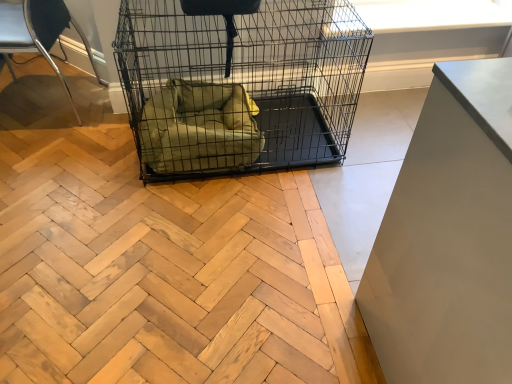
Question: Is metallic silver chair at left facing towards green fabric dog bed at center?

Choices:
 (A) no
 (B) yes

Answer: (A)

Question: Is metallic silver chair at left closer to the viewer compared to green fabric dog bed at center?

Choices:
 (A) yes
 (B) no

Answer: (A)

Question: Would you say metallic silver chair at left is outside green fabric dog bed at center?

Choices:
 (A) yes
 (B) no

Answer: (A)

Question: From a real-world perspective, does metallic silver chair at left sit lower than green fabric dog bed at center?

Choices:
 (A) no
 (B) yes

Answer: (A)

Question: Does metallic silver chair at left have a greater height compared to green fabric dog bed at center?

Choices:
 (A) no
 (B) yes

Answer: (B)

Question: Do you think white matte cabinet at right is within metallic silver chair at left, or outside of it?

Choices:
 (A) outside
 (B) inside

Answer: (A)

Question: From a real-world perspective, is white matte cabinet at right physically located above or below metallic silver chair at left?

Choices:
 (A) below
 (B) above

Answer: (B)

Question: From the image's perspective, relative to metallic silver chair at left, is white matte cabinet at right above or below?

Choices:
 (A) below
 (B) above

Answer: (A)

Question: Is white matte cabinet at right bigger or smaller than metallic silver chair at left?

Choices:
 (A) small
 (B) big

Answer: (B)

Question: Is black wire mesh cage at center spatially inside metallic silver chair at left, or outside of it?

Choices:
 (A) inside
 (B) outside

Answer: (B)

Question: In terms of width, does black wire mesh cage at center look wider or thinner when compared to metallic silver chair at left?

Choices:
 (A) thin
 (B) wide

Answer: (B)

Question: In terms of height, does black wire mesh cage at center look taller or shorter compared to metallic silver chair at left?

Choices:
 (A) short
 (B) tall

Answer: (A)

Question: Considering the positions of point (132, 64) and point (13, 29), is point (132, 64) closer or farther from the camera than point (13, 29)?

Choices:
 (A) closer
 (B) farther

Answer: (A)

Question: Considering the positions of green fabric dog bed at center and black wire mesh cage at center in the image, is green fabric dog bed at center wider or thinner than black wire mesh cage at center?

Choices:
 (A) thin
 (B) wide

Answer: (A)

Question: Considering the positions of green fabric dog bed at center and black wire mesh cage at center in the image, is green fabric dog bed at center taller or shorter than black wire mesh cage at center?

Choices:
 (A) short
 (B) tall

Answer: (A)